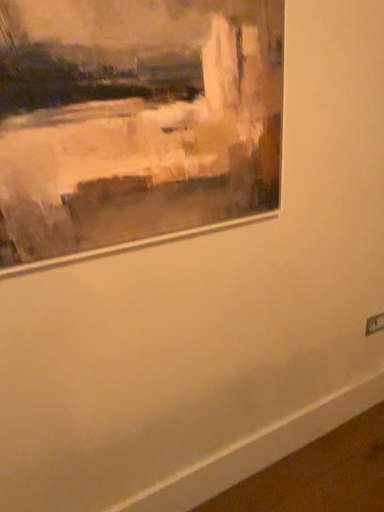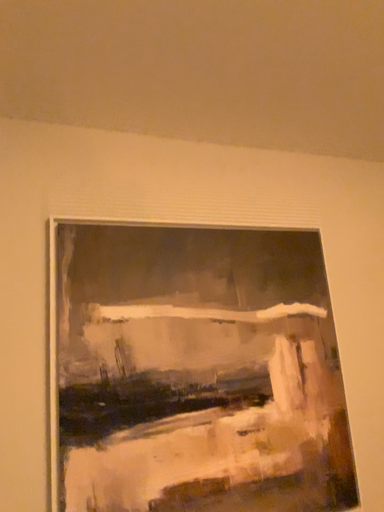
Question: How did the camera likely rotate when shooting the video?

Choices:
 (A) rotated upward
 (B) rotated downward

Answer: (A)